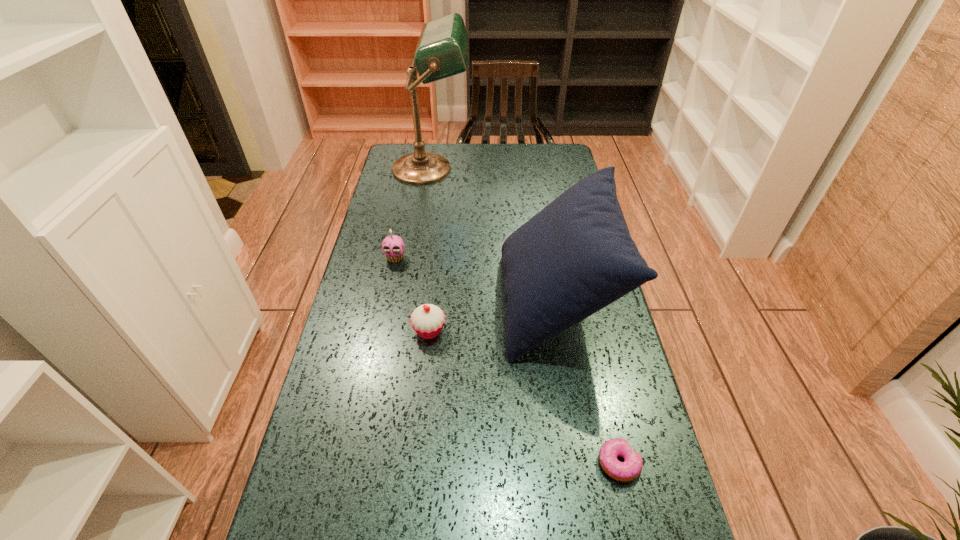
At what (x,y) coordinates should I click in order to perform the action: click on doughnut that is at the right edge. Please return your answer as a coordinate pair (x, y). The width and height of the screenshot is (960, 540). Looking at the image, I should click on (631, 468).

Identify the location of object at the far left corner. (442, 49).

Locate an element on the screen. This screenshot has width=960, height=540. blank area at the left edge is located at coordinates (372, 221).

Find the location of a particular element. Image resolution: width=960 pixels, height=540 pixels. free space at the right edge of the desktop is located at coordinates (564, 185).

I want to click on free location at the far left corner, so click(x=393, y=154).

In the image, there is a desktop. Find the location of `free space at the far right corner`. free space at the far right corner is located at coordinates (542, 164).

You are a GUI agent. You are given a task and a screenshot of the screen. Output one action in this format:
    pyautogui.click(x=<x>, y=<y>)
    Task: Click on the vacant area that lies between the second tallest object and the table lamp
    
    Given the screenshot: What is the action you would take?
    pyautogui.click(x=493, y=235)

I want to click on free space between the nearer cupcake and the second tallest object, so [x=492, y=316].

What are the coordinates of `blank region between the table lamp and the third tallest object` in the screenshot? It's located at (413, 213).

Locate an element on the screen. This screenshot has width=960, height=540. empty space between the farther cupcake and the shortest object is located at coordinates click(507, 360).